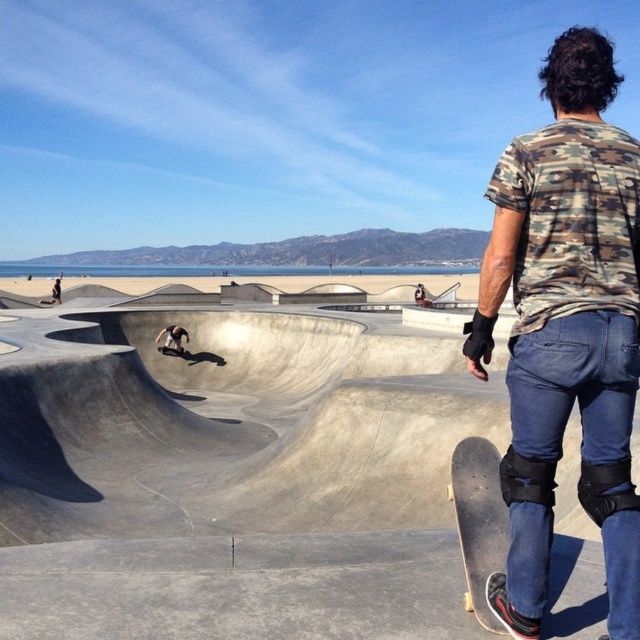
You are a photographer at the skatepark and want to capture both the matte black skateboard at center and the black smooth skateboard at center in a single shot. Which skateboard should you focus on first if you want to include both in your frame?

The matte black skateboard at center is positioned on the right side of the black smooth skateboard at center, so you should focus on the black smooth skateboard at center first to ensure both are within the frame.

You are a skateboarder trying to determine if your black smooth skateboard at center will fit entirely within the concrete skate park at center. Based on the scene, can you confirm if the skateboard will fit without any part hanging over the edges?

The concrete skate park at center might be wider than black smooth skateboard at center, so there is a possibility that the skateboard will fit without overhanging, but the exact dimensions are uncertain.